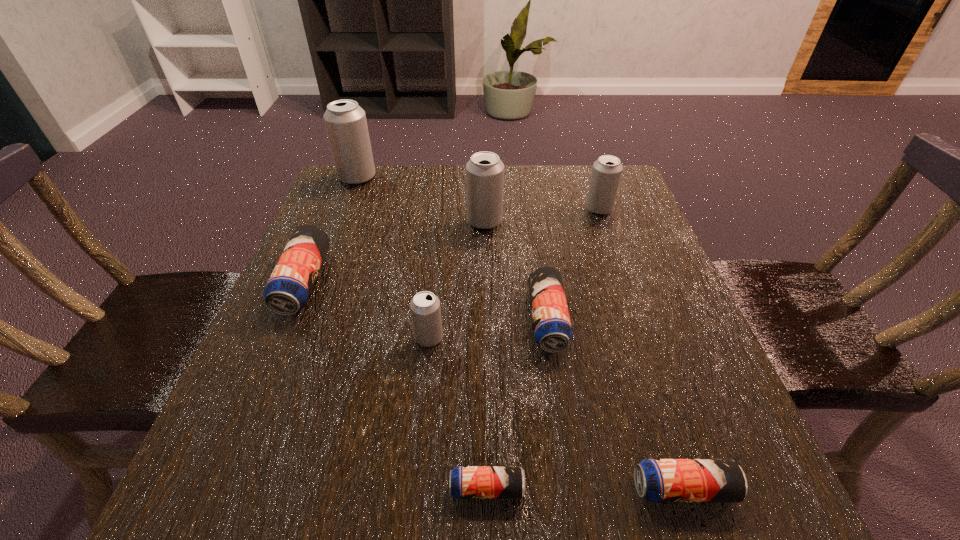
You are a GUI agent. You are given a task and a screenshot of the screen. Output one action in this format:
    pyautogui.click(x=<x>, y=<y>)
    Task: Click on the vacant space that satisfies the following two spatial constraints: 1. on the front side of the rightmost blue beer can; 2. on the left side of the biggest white beer can
    The height and width of the screenshot is (540, 960).
    Given the screenshot: What is the action you would take?
    pyautogui.click(x=235, y=489)